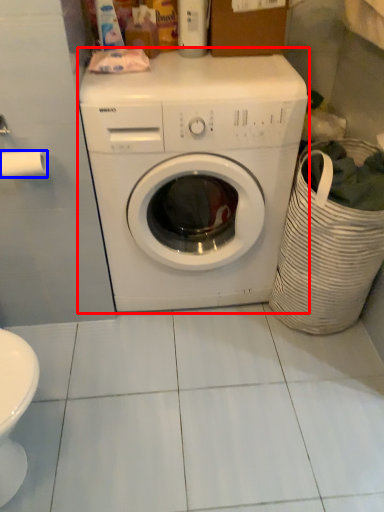
Question: Among these objects, which one is farthest to the camera, washing machine (highlighted by a red box) or toilet paper (highlighted by a blue box)?

Choices:
 (A) washing machine
 (B) toilet paper

Answer: (B)